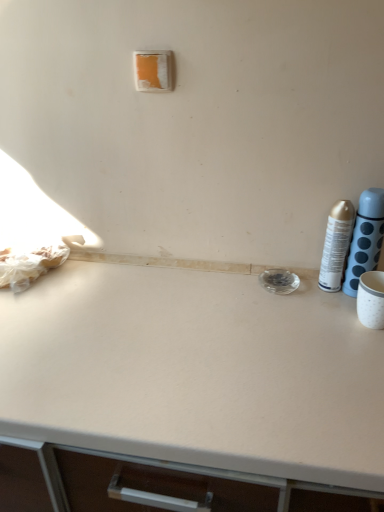
Question: Can you confirm if metallic silver spray can at right, acting as the 2th bottle starting from the left, is bigger than silver metallic can at right, placed as the 2th bottle when sorted from right to left?

Choices:
 (A) no
 (B) yes

Answer: (B)

Question: Considering the relative sizes of metallic silver spray can at right, acting as the 2th bottle starting from the left, and silver metallic can at right, which appears as the first bottle when viewed from the left, in the image provided, is metallic silver spray can at right, acting as the 2th bottle starting from the left, taller than silver metallic can at right, which appears as the first bottle when viewed from the left,?

Choices:
 (A) no
 (B) yes

Answer: (B)

Question: Can you confirm if metallic silver spray can at right, acting as the 2th bottle starting from the left, is wider than silver metallic can at right, which appears as the first bottle when viewed from the left?

Choices:
 (A) yes
 (B) no

Answer: (A)

Question: Is metallic silver spray can at right, acting as the 2th bottle starting from the left, positioned before silver metallic can at right, placed as the 2th bottle when sorted from right to left?

Choices:
 (A) yes
 (B) no

Answer: (A)

Question: Can you confirm if metallic silver spray can at right, positioned as the first bottle in right-to-left order, is positioned to the left of silver metallic can at right, which appears as the first bottle when viewed from the left?

Choices:
 (A) no
 (B) yes

Answer: (A)

Question: From the image's perspective, is metallic silver spray can at right, positioned as the first bottle in right-to-left order, located beneath silver metallic can at right, which appears as the first bottle when viewed from the left?

Choices:
 (A) no
 (B) yes

Answer: (A)

Question: Is orange matte/light switch at upper center shorter than silver metallic can at right, which appears as the first bottle when viewed from the left?

Choices:
 (A) yes
 (B) no

Answer: (A)

Question: Is orange matte/light switch at upper center aimed at silver metallic can at right, which appears as the first bottle when viewed from the left?

Choices:
 (A) yes
 (B) no

Answer: (B)

Question: Are orange matte/light switch at upper center and silver metallic can at right, placed as the 2th bottle when sorted from right to left, beside each other?

Choices:
 (A) yes
 (B) no

Answer: (B)

Question: Is the position of orange matte/light switch at upper center less distant than that of silver metallic can at right, which appears as the first bottle when viewed from the left?

Choices:
 (A) no
 (B) yes

Answer: (A)

Question: Can you confirm if orange matte/light switch at upper center is smaller than silver metallic can at right, which appears as the first bottle when viewed from the left?

Choices:
 (A) no
 (B) yes

Answer: (B)

Question: Is the depth of orange matte/light switch at upper center greater than that of silver metallic can at right, placed as the 2th bottle when sorted from right to left?

Choices:
 (A) yes
 (B) no

Answer: (A)

Question: Considering the relative sizes of silver metallic can at right, which appears as the first bottle when viewed from the left, and metallic silver spray can at right, positioned as the first bottle in right-to-left order, in the image provided, is silver metallic can at right, which appears as the first bottle when viewed from the left, smaller than metallic silver spray can at right, positioned as the first bottle in right-to-left order,?

Choices:
 (A) yes
 (B) no

Answer: (A)